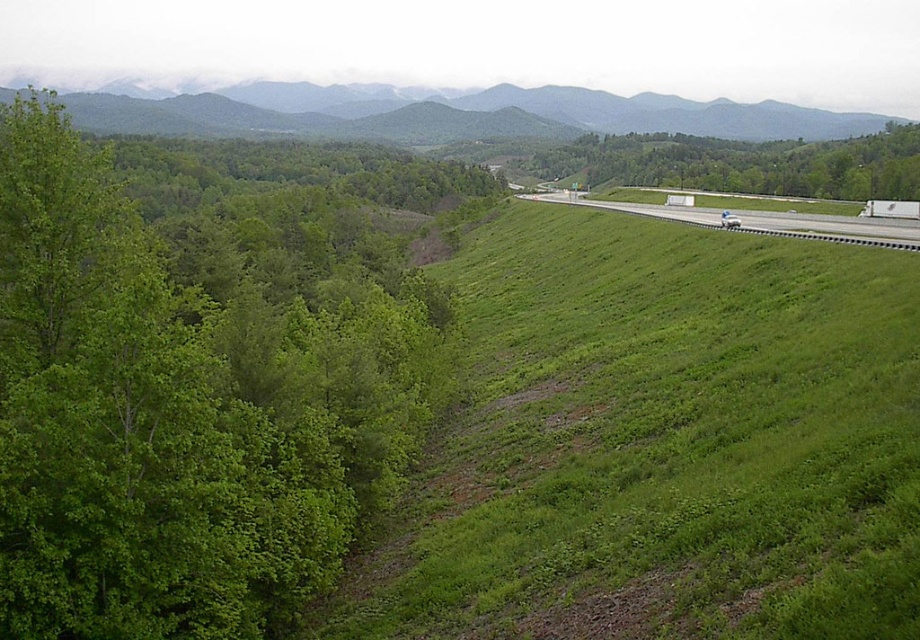
Who is higher up, green leafy tree at center or white asphalt highway at right?

green leafy tree at center is above.

Is green leafy tree at center smaller than white asphalt highway at right?

Actually, green leafy tree at center might be larger than white asphalt highway at right.

The height and width of the screenshot is (640, 920). What do you see at coordinates (743, 164) in the screenshot?
I see `green leafy tree at center` at bounding box center [743, 164].

This screenshot has width=920, height=640. Find the location of `green leafy tree at center`. green leafy tree at center is located at coordinates (743, 164).

Does green leafy tree at left have a greater height compared to white asphalt highway at right?

Indeed, green leafy tree at left has a greater height compared to white asphalt highway at right.

Looking at this image, can you confirm if green leafy tree at left is thinner than white asphalt highway at right?

Incorrect, green leafy tree at left's width is not less than white asphalt highway at right's.

Does point (283, 291) come in front of point (807, 230)?

No, it is not.

Identify the location of green leafy tree at left. (194, 394).

The image size is (920, 640). What do you see at coordinates (194, 394) in the screenshot?
I see `green leafy tree at left` at bounding box center [194, 394].

Which is more to the left, green leafy tree at left or green grassy hillside at upper center?

green leafy tree at left

Between point (447, 396) and point (506, 113), which one is positioned in front?

Positioned in front is point (447, 396).

The height and width of the screenshot is (640, 920). Identify the location of green leafy tree at left. (194, 394).